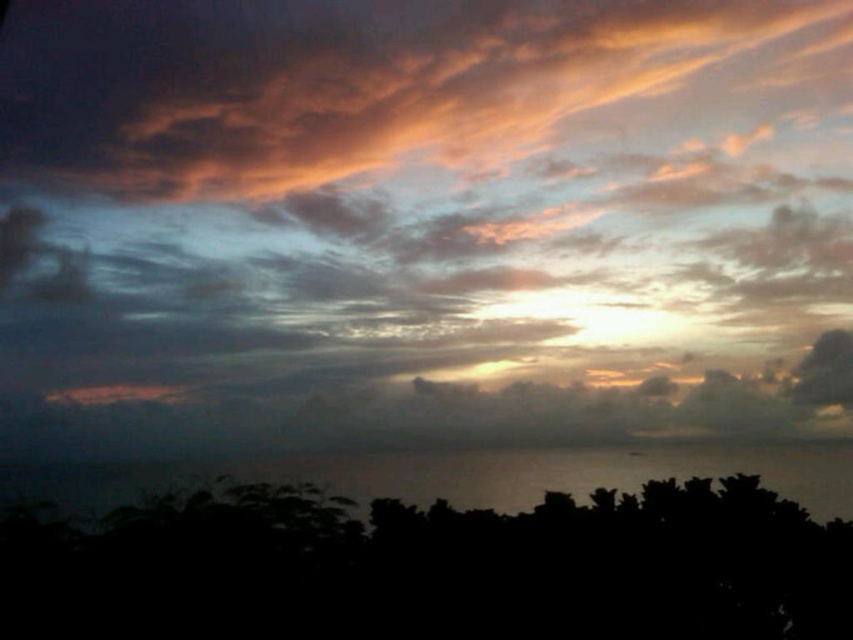
Is cloudy sky at upper center wider than black matte tree at lower center?

In fact, cloudy sky at upper center might be narrower than black matte tree at lower center.

Does cloudy sky at upper center have a greater height compared to black matte tree at lower center?

Indeed, cloudy sky at upper center has a greater height compared to black matte tree at lower center.

Describe the element at coordinates (422, 221) in the screenshot. The height and width of the screenshot is (640, 853). I see `cloudy sky at upper center` at that location.

I want to click on cloudy sky at upper center, so 422,221.